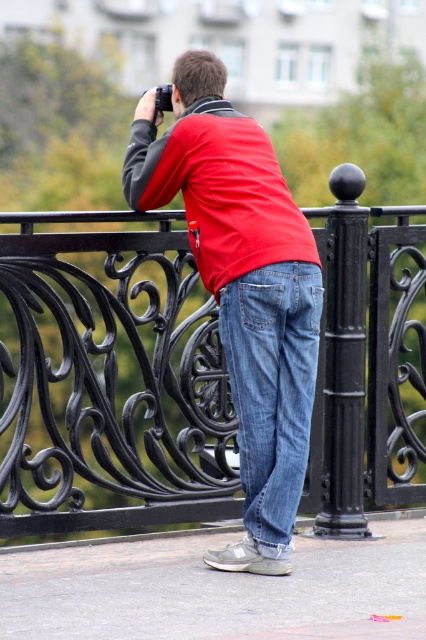
Which is above, black wrought iron fence at center or matte red shirt at center?

matte red shirt at center

In the scene shown: Between black wrought iron fence at center and matte red shirt at center, which one appears on the right side from the viewer's perspective?

Positioned to the right is matte red shirt at center.

Is point (322, 257) farther from viewer compared to point (224, 552)?

Yes, it is.

You are a GUI agent. You are given a task and a screenshot of the screen. Output one action in this format:
    pyautogui.click(x=<x>, y=<y>)
    Task: Click on the black wrought iron fence at center
    Image resolution: width=426 pixels, height=640 pixels.
    Given the screenshot: What is the action you would take?
    coord(109,381)

Is black wrought iron fence at center below blue denim jeans at center?

No.

Is point (379, 321) less distant than point (281, 529)?

No, it is behind (281, 529).

Does point (204, 369) come in front of point (239, 342)?

No, (204, 369) is behind (239, 342).

Find the location of a particular element. Image resolution: width=426 pixels, height=640 pixels. black wrought iron fence at center is located at coordinates (109, 381).

Can you confirm if matte red shirt at center is taller than blue denim jeans at center?

Indeed, matte red shirt at center has a greater height compared to blue denim jeans at center.

Can you confirm if matte red shirt at center is positioned below blue denim jeans at center?

Actually, matte red shirt at center is above blue denim jeans at center.

Does point (261, 563) lie behind point (278, 268)?

Yes, point (261, 563) is farther from viewer.

This screenshot has width=426, height=640. Find the location of `matte red shirt at center`. matte red shirt at center is located at coordinates (241, 288).